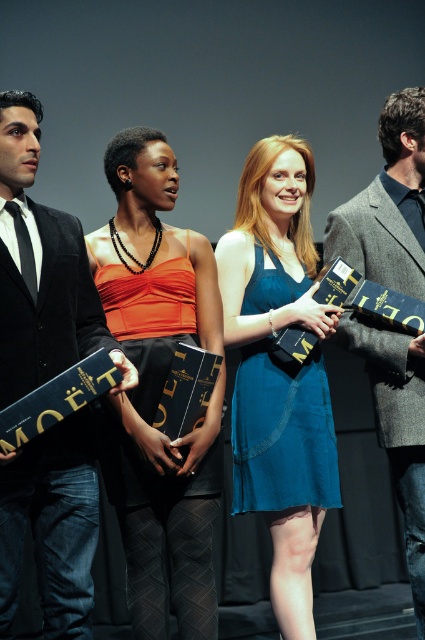
Question: Estimate the real-world distances between objects in this image. Which object is closer to the teal denim dress at center?

Choices:
 (A) orange satin dress at center
 (B) black suit at left

Answer: (A)

Question: From the image, what is the correct spatial relationship of orange satin dress at center in relation to teal denim dress at center?

Choices:
 (A) above
 (B) below

Answer: (A)

Question: Which object appears closest to the camera in this image?

Choices:
 (A) gray wool suit at right
 (B) black suit at left
 (C) orange satin dress at center
 (D) teal denim dress at center

Answer: (B)

Question: Which of these objects is positioned farthest from the black suit at left?

Choices:
 (A) gray wool suit at right
 (B) orange satin dress at center
 (C) teal silk dress at center

Answer: (A)

Question: Can you confirm if teal denim dress at center is positioned to the right of teal silk dress at center?

Choices:
 (A) yes
 (B) no

Answer: (A)

Question: Observing the image, what is the correct spatial positioning of black suit at left in reference to teal silk dress at center?

Choices:
 (A) below
 (B) above

Answer: (B)